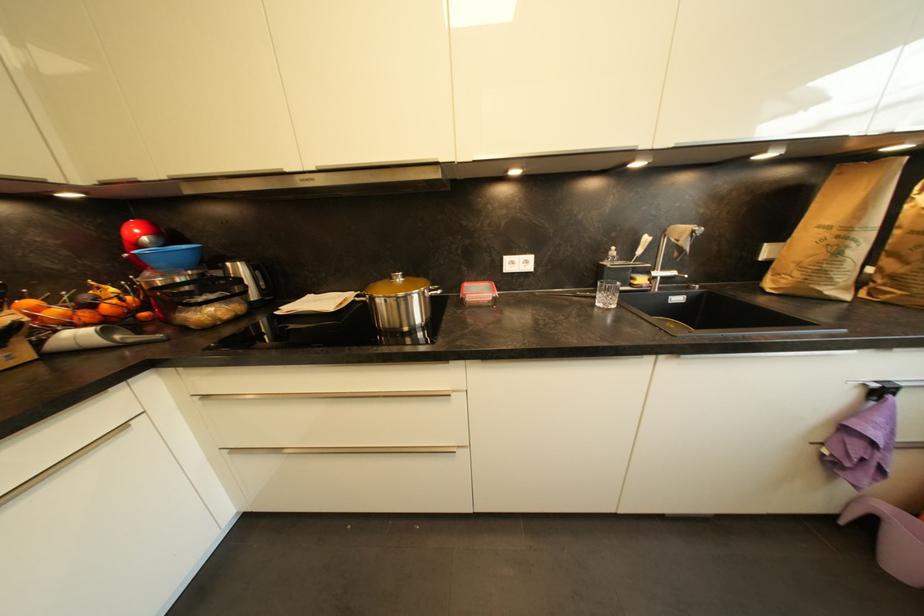
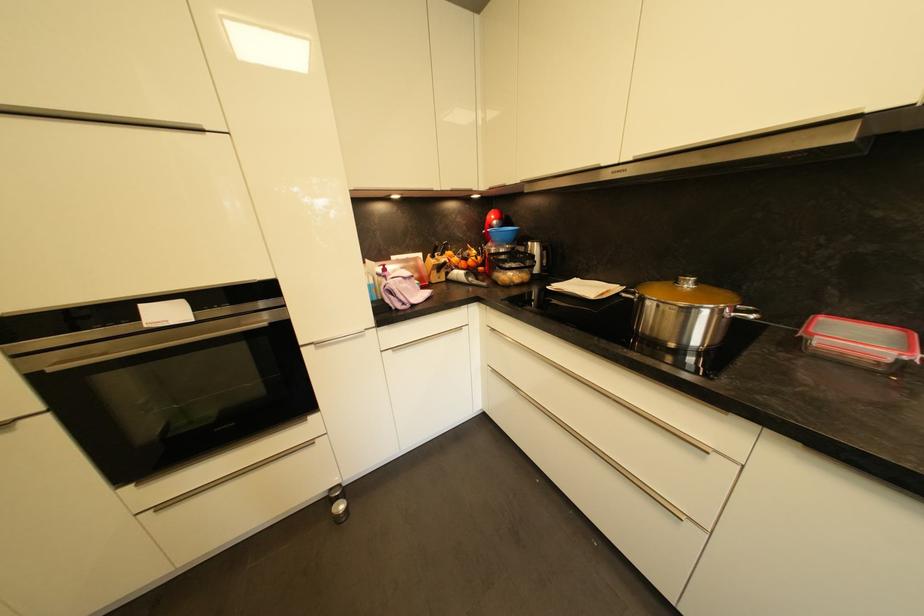
Find the pixel in the second image that matches point (444, 294) in the first image.

(758, 318)